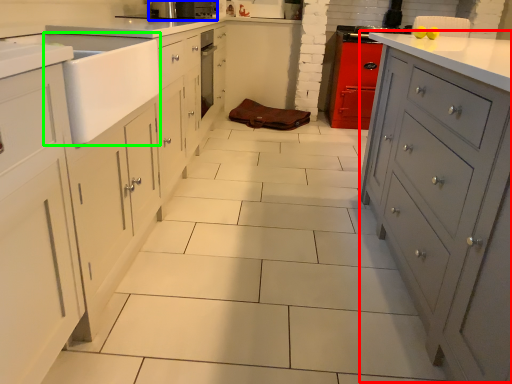
Question: Which object is positioned closest to file cabinet (highlighted by a red box)? Select from home appliance (highlighted by a blue box) and sink (highlighted by a green box).

Choices:
 (A) home appliance
 (B) sink

Answer: (B)